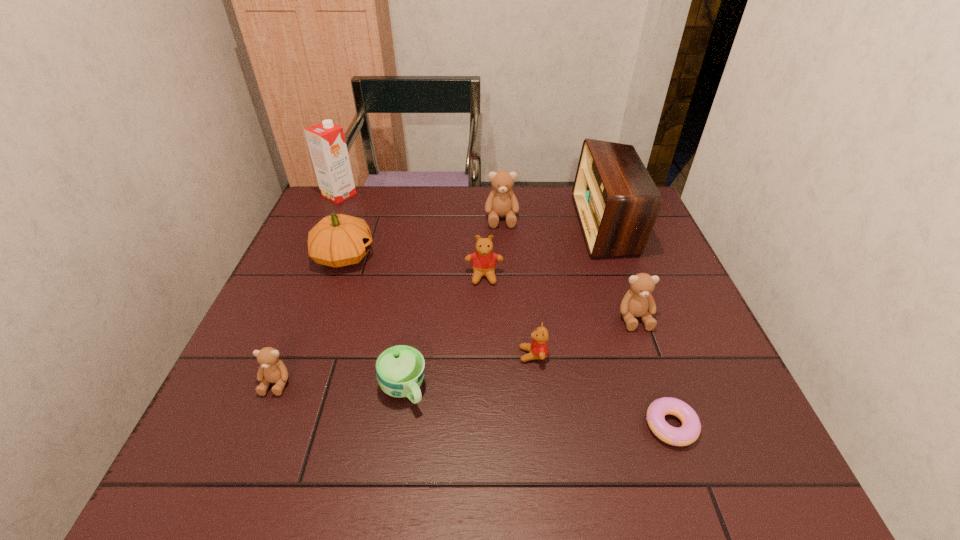
This screenshot has height=540, width=960. Identify the location of the second nearest teddy bear. (538, 348).

Locate an element on the screen. The height and width of the screenshot is (540, 960). the leftmost brown teddy bear is located at coordinates (272, 370).

Find the location of `the nearest brown teddy bear`. the nearest brown teddy bear is located at coordinates point(272,370).

Identify the location of cup. (400, 369).

Where is `the second shortest object`? The width and height of the screenshot is (960, 540). the second shortest object is located at coordinates (400, 369).

Image resolution: width=960 pixels, height=540 pixels. Identify the location of doughnut. (688, 433).

At what (x,y) coordinates should I click in order to perform the action: click on vacant space situated 0.200m on the right of the carton. Please return your answer as a coordinate pair (x, y). This screenshot has width=960, height=540. Looking at the image, I should click on (417, 194).

Find the location of a particular element. This screenshot has height=540, width=960. vacant region located 0.280m on the front-facing side of the radio receiver is located at coordinates (487, 225).

At what (x,y) coordinates should I click in order to perform the action: click on vacant space positioned 0.110m on the front-facing side of the radio receiver. Please return your answer as a coordinate pair (x, y). Looking at the image, I should click on (543, 225).

I want to click on vacant space located 0.360m on the front-facing side of the radio receiver, so click(461, 225).